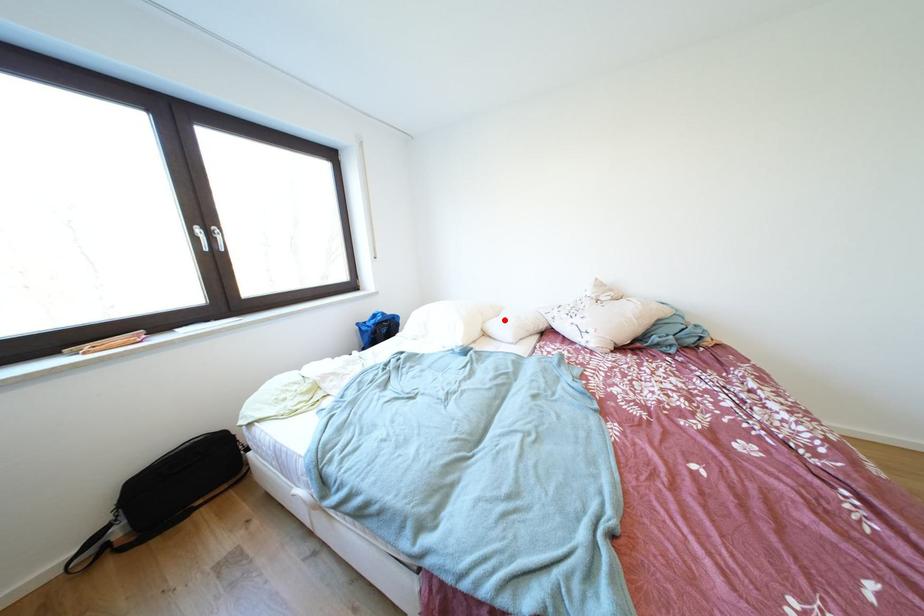
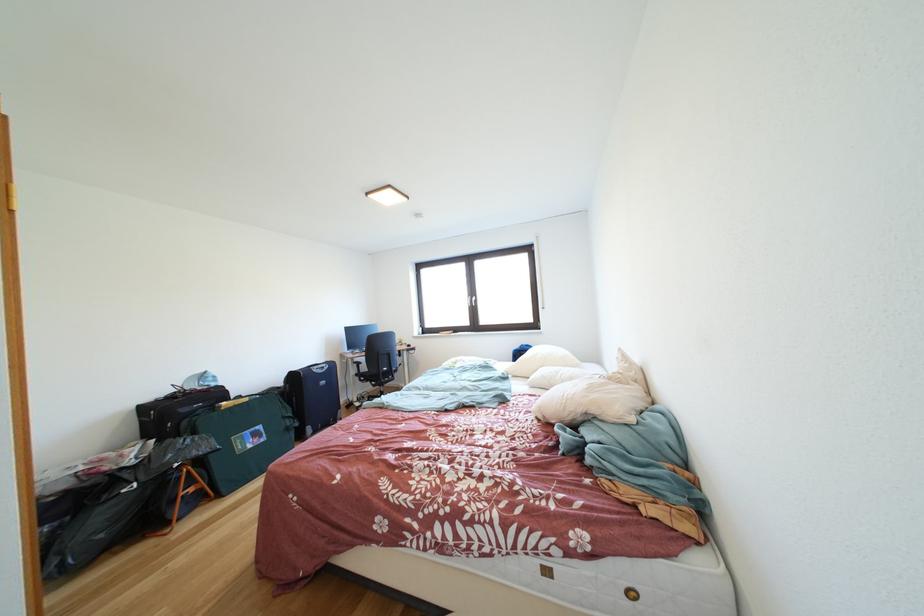
In the second image, find the point that corresponds to the highlighted location in the first image.

(570, 371)